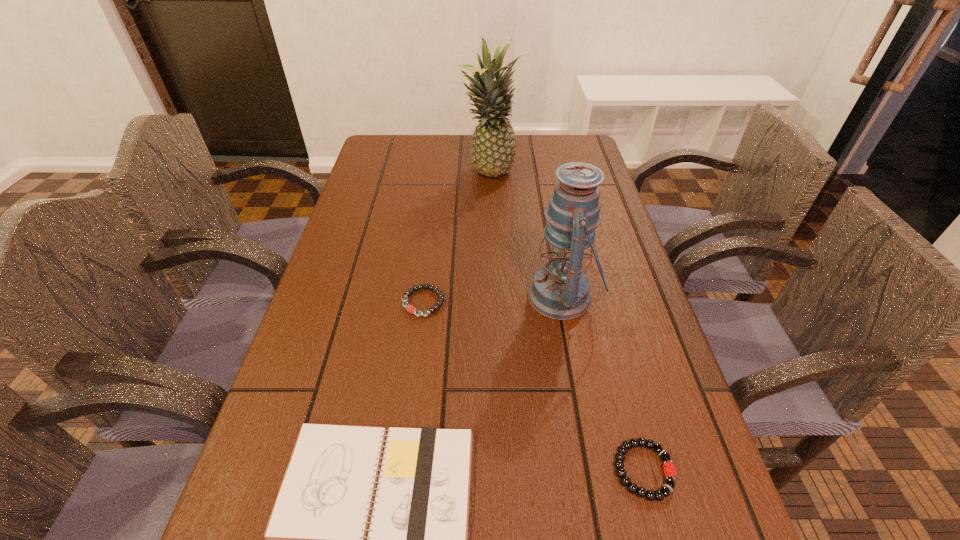
Image resolution: width=960 pixels, height=540 pixels. I want to click on pineapple, so click(493, 150).

Where is `the second tallest object`? This screenshot has width=960, height=540. the second tallest object is located at coordinates (560, 290).

Find the location of `the nearer bracelet`. the nearer bracelet is located at coordinates (669, 470).

The width and height of the screenshot is (960, 540). What are the coordinates of `the farther bracelet` in the screenshot? It's located at (411, 309).

The height and width of the screenshot is (540, 960). I want to click on free space located 0.290m on the front of the pineapple, so click(x=490, y=253).

The image size is (960, 540). In order to click on vacant space situated 0.070m on the front-facing side of the fourth shortest object in this screenshot , I will do `click(496, 296)`.

Image resolution: width=960 pixels, height=540 pixels. Find the location of `blank space located 0.100m on the front-facing side of the fourth shortest object`. blank space located 0.100m on the front-facing side of the fourth shortest object is located at coordinates (483, 296).

I want to click on free space located on the front-facing side of the fourth shortest object, so click(506, 296).

In order to click on vacant position located 0.110m on the left of the right bracelet in this screenshot , I will do `click(546, 470)`.

Locate an element on the screen. Image resolution: width=960 pixels, height=540 pixels. vacant space located 0.080m on the front of the farther bracelet is located at coordinates (418, 349).